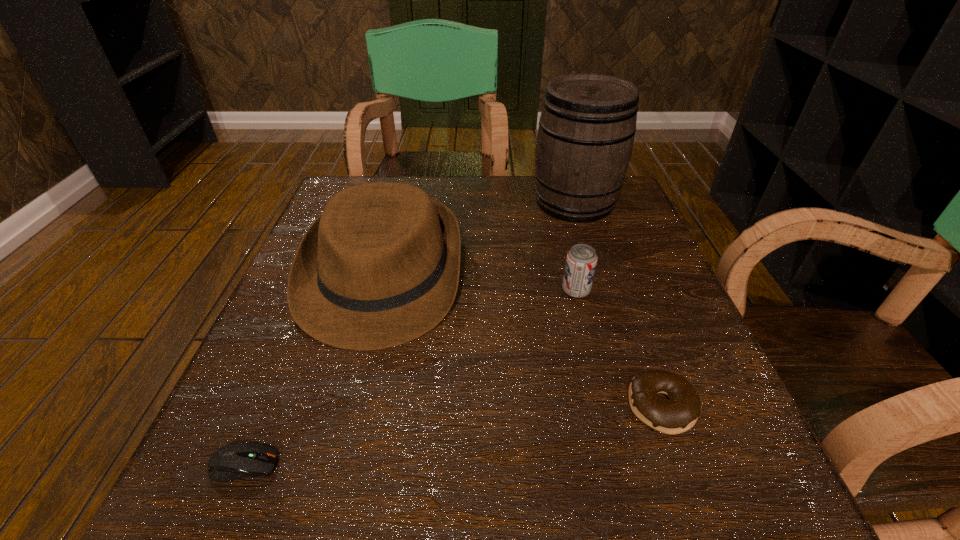
Find the location of `the tallest object`. the tallest object is located at coordinates (585, 138).

You are a GUI agent. You are given a task and a screenshot of the screen. Output one action in this format:
    pyautogui.click(x=<x>, y=<y>)
    Task: Click on the fourth shortest object
    
    Given the screenshot: What is the action you would take?
    pyautogui.click(x=380, y=267)

The width and height of the screenshot is (960, 540). Identify the location of the third tallest object. (581, 260).

You are a GUI agent. You are given a task and a screenshot of the screen. Output one action in this format:
    pyautogui.click(x=<x>, y=<y>)
    Task: Click on the doughnut
    The width and height of the screenshot is (960, 540).
    Given the screenshot: What is the action you would take?
    (678, 414)

Locate an element on the screen. This screenshot has width=960, height=540. the fourth farthest object is located at coordinates click(678, 414).

I want to click on the shortest object, so 234,461.

Locate an element on the screen. Image resolution: width=960 pixels, height=540 pixels. computer equipment is located at coordinates (234, 461).

The height and width of the screenshot is (540, 960). I want to click on free location located 0.400m on the front of the wine bucket, so click(x=628, y=377).

Locate an element on the screen. vacant region located 0.210m on the front-facing side of the fedora is located at coordinates (330, 481).

Where is `vacant space situated on the left of the third tallest object`? vacant space situated on the left of the third tallest object is located at coordinates (384, 291).